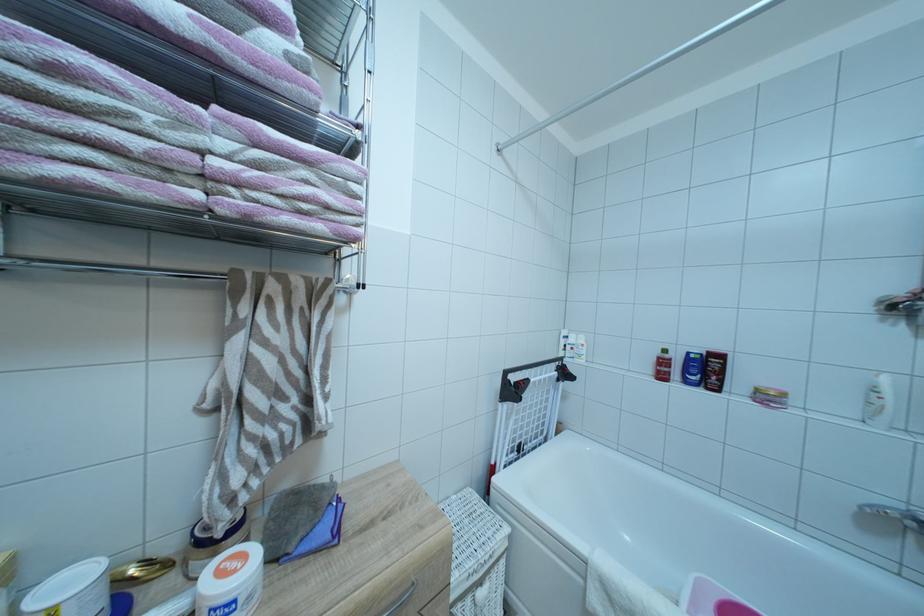
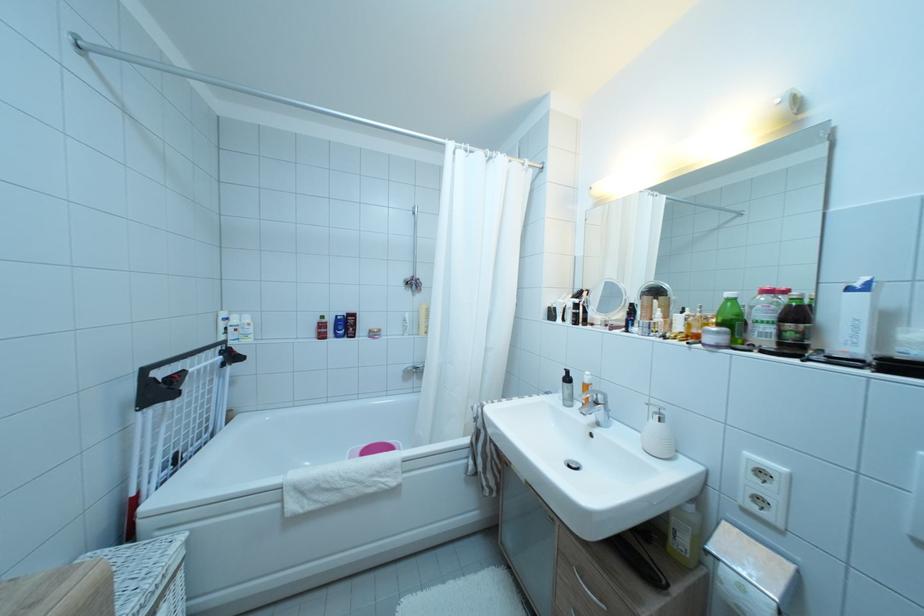
The point at (664,359) is marked in the first image. Where is the corresponding point in the second image?

(324, 325)